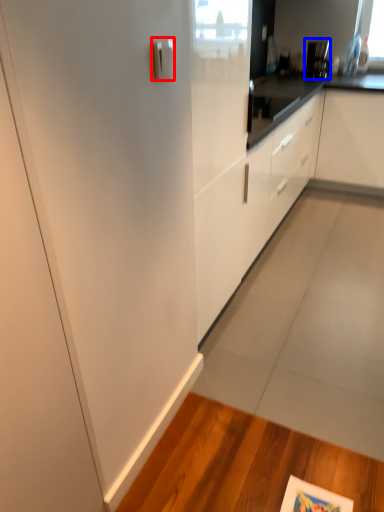
Question: Which object appears closest to the camera in this image, door handle (highlighted by a red box) or appliance (highlighted by a blue box)?

Choices:
 (A) door handle
 (B) appliance

Answer: (A)